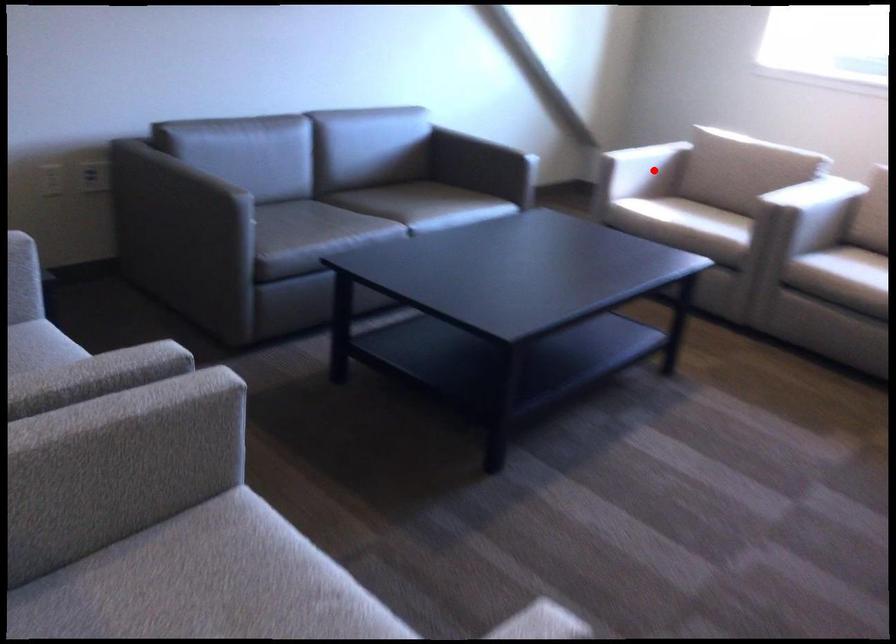
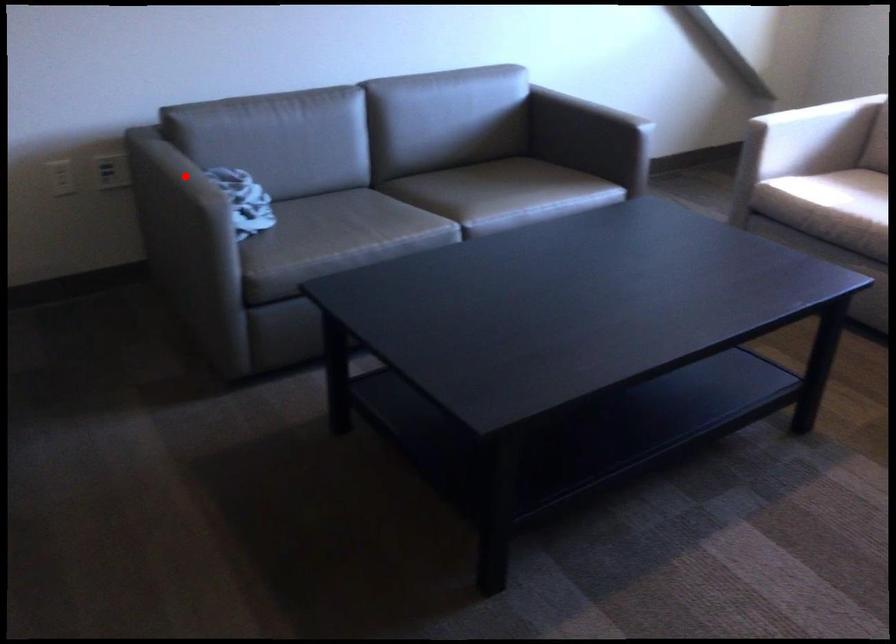
I am providing you with two images of the same scene from different viewpoints. A red point is marked on the first image and another point is marked on the second image. Are the points marked in image1 and image2 representing the same 3D position?

No